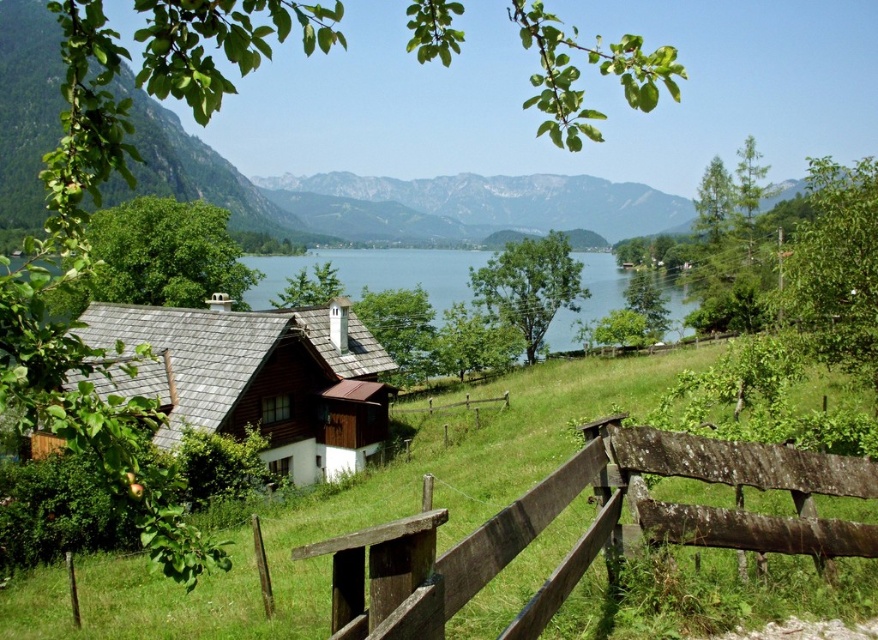
Based on the photo, can you confirm if weathered wood fence at lower right is positioned below blue water at center?

Indeed, weathered wood fence at lower right is positioned under blue water at center.

Which of these two, weathered wood fence at lower right or blue water at center, stands shorter?

With less height is weathered wood fence at lower right.

Find the location of a particular element. The width and height of the screenshot is (878, 640). weathered wood fence at lower right is located at coordinates (589, 528).

I want to click on weathered wood fence at lower right, so pos(589,528).

Between green grassy at lower center and blue water at center, which one is positioned higher?

Positioned higher is blue water at center.

Who is positioned more to the left, green grassy at lower center or blue water at center?

Positioned to the left is green grassy at lower center.

This screenshot has height=640, width=878. I want to click on green grassy at lower center, so click(349, 516).

Is point (243, 593) in front of point (836, 476)?

That is False.

Does green grassy at lower center have a larger size compared to weathered wood fence at lower right?

Indeed, green grassy at lower center has a larger size compared to weathered wood fence at lower right.

Does point (663, 492) come closer to viewer compared to point (645, 432)?

No, it is not.

The image size is (878, 640). Find the location of `green grassy at lower center`. green grassy at lower center is located at coordinates (349, 516).